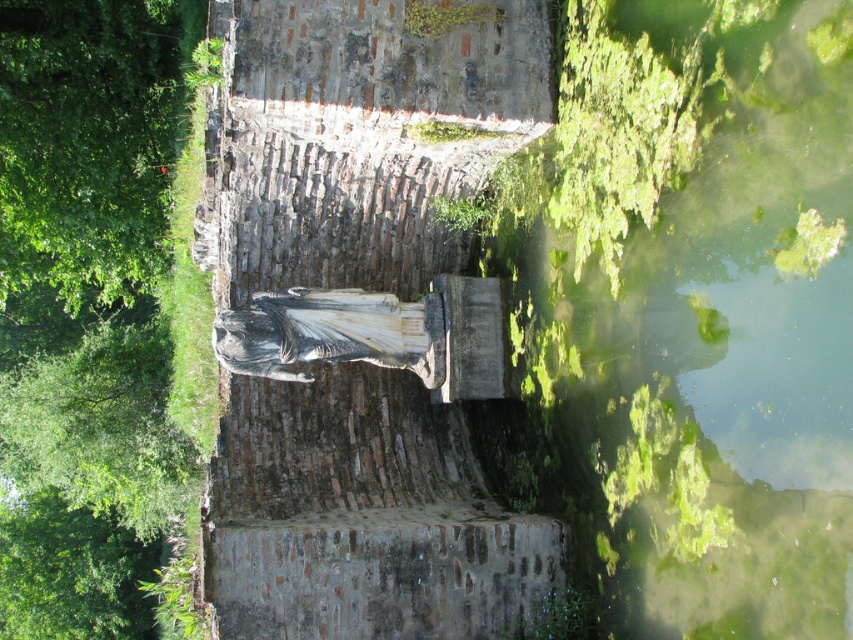
Question: Which point appears closest to the camera in this image?

Choices:
 (A) (643, 230)
 (B) (161, 196)

Answer: (A)

Question: Is the position of green algae water at lower right less distant than that of green leafy tree at upper left?

Choices:
 (A) yes
 (B) no

Answer: (A)

Question: Considering the real-world distances, which object is farthest from the green mossy stone statue at center?

Choices:
 (A) green algae water at lower right
 (B) green leafy tree at upper left

Answer: (B)

Question: Does green algae water at lower right have a smaller size compared to green leafy tree at upper left?

Choices:
 (A) no
 (B) yes

Answer: (B)

Question: Is green algae water at lower right thinner than green leafy tree at upper left?

Choices:
 (A) yes
 (B) no

Answer: (A)

Question: Which of these objects is positioned closest to the green algae water at lower right?

Choices:
 (A) green leafy tree at upper left
 (B) green mossy stone statue at center

Answer: (B)